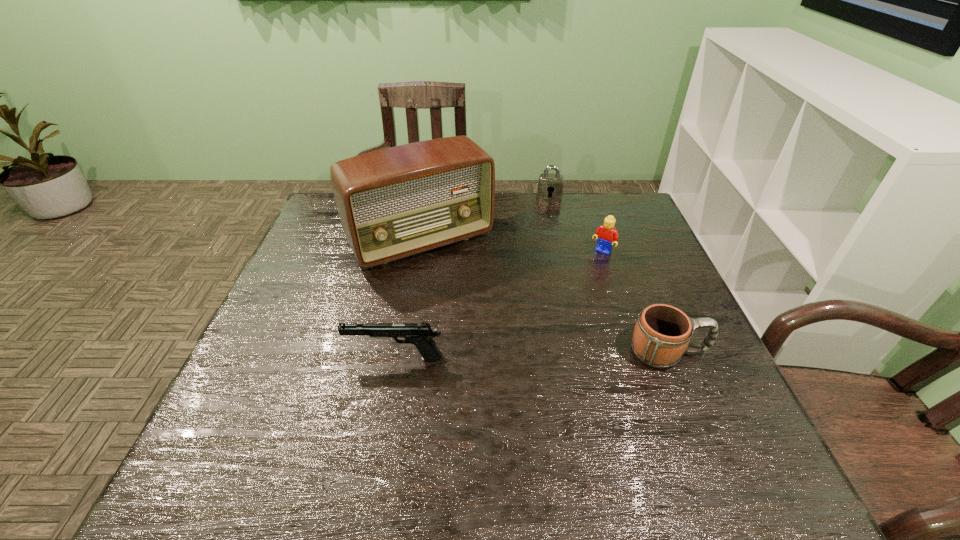
This screenshot has width=960, height=540. What are the coordinates of `free region located on the front-facing side of the tallest object` in the screenshot? It's located at (463, 288).

Identify the location of free space located 0.110m on the front-facing side of the tallest object. (469, 298).

Where is `vacant space located 0.150m on the front-facing side of the Lego`? This screenshot has height=540, width=960. vacant space located 0.150m on the front-facing side of the Lego is located at coordinates (575, 286).

Where is `blank area located on the front-facing side of the Lego`? blank area located on the front-facing side of the Lego is located at coordinates (575, 286).

Locate an element on the screen. vacant space positioned 0.160m on the front-facing side of the Lego is located at coordinates (573, 288).

I want to click on free space located 0.310m at the front of the padlock near the keyhole, so tap(551, 258).

The height and width of the screenshot is (540, 960). Identify the location of vacant region located at the front of the padlock near the keyhole. (550, 243).

This screenshot has height=540, width=960. Identify the location of vacant point located 0.230m at the front of the padlock near the keyhole. (550, 241).

Find the location of a particular element. radio receiver present at the far edge is located at coordinates 396,202.

Image resolution: width=960 pixels, height=540 pixels. What are the coordinates of `padlock that is at the far edge` in the screenshot? It's located at (550, 186).